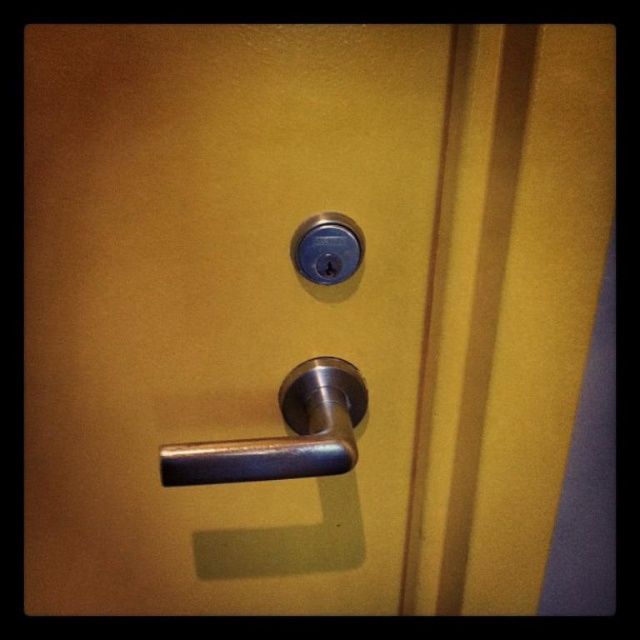
From the picture: Is polished metal door handle at center smaller than satin nickel lock at center?

Actually, polished metal door handle at center might be larger than satin nickel lock at center.

Which is in front, point (333, 392) or point (328, 236)?

Point (328, 236) is in front.

This screenshot has height=640, width=640. I want to click on polished metal door handle at center, so click(x=285, y=435).

Does metallic silver handle at center have a greater width compared to polished metal door handle at center?

Yes.

Does metallic silver handle at center come behind polished metal door handle at center?

Yes.

This screenshot has width=640, height=640. Describe the element at coordinates (218, 305) in the screenshot. I see `metallic silver handle at center` at that location.

Find the location of a particular element. metallic silver handle at center is located at coordinates (218, 305).

Is metallic silver handle at center behind satin nickel lock at center?

No.

Where is `metallic silver handle at center`? The height and width of the screenshot is (640, 640). metallic silver handle at center is located at coordinates pyautogui.click(x=218, y=305).

Where is `metallic silver handle at center`? metallic silver handle at center is located at coordinates (218, 305).